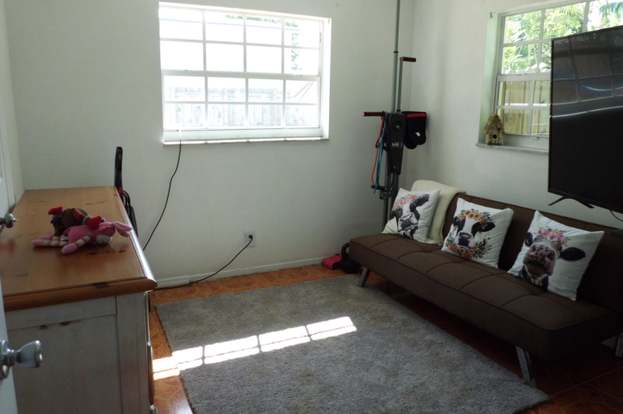
Where is `door knob`? door knob is located at coordinates (24, 355).